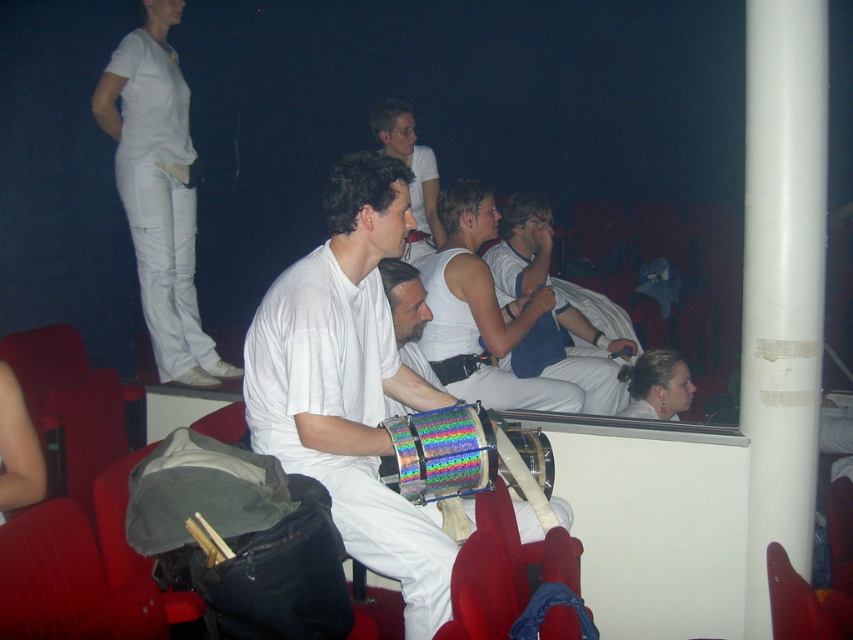
Consider the image. You are sitting in the theater and want to move from point A to point B. Point A is at coordinate point point (529, 198) and point B is at coordinate point (428, 189). Which point is closer to the front of the theater?

Point (428, 189) is closer to the front of the theater because point (529, 198) is in front of point (428, 189).